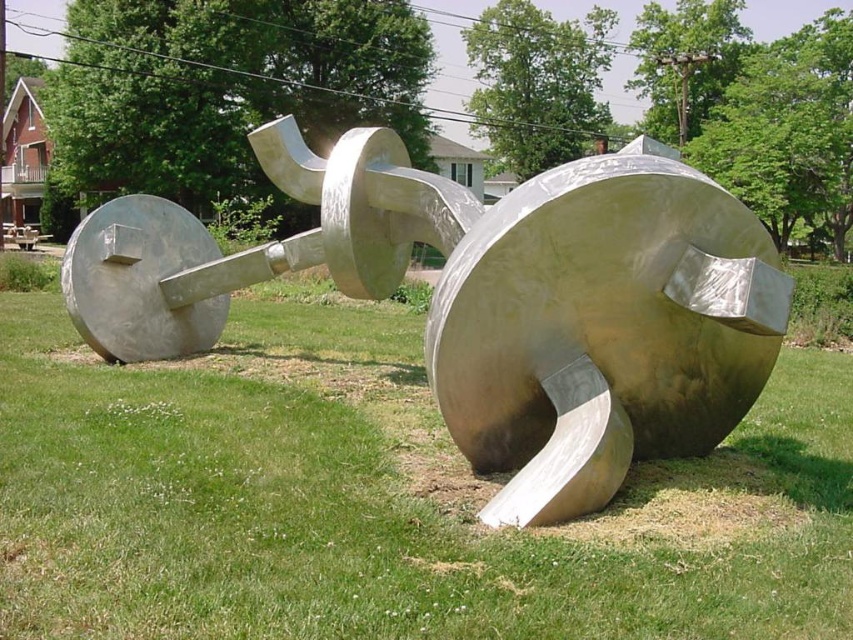
You are standing in front of the sculpture and want to step onto the green grass at center. In which direction should you move relative to the polished silver sculpture at center?

You should move to the left of the polished silver sculpture at center because the green grass at center is located to the left of it.

Based on the photo, you are a gardener who needs to water the green grass at center and the polished silver sculpture at center. You have a hose that can reach 10 feet. Can you water both areas without moving the hose?

The green grass at center and polished silver sculpture at center are 10.87 feet apart from each other. Since the hose can only reach 10 feet, you cannot water both areas without moving the hose because the distance exceeds the hose length.

In the scene shown: You are planning to place a small garden ornament that is 20 cm wide in the area shown. Based on the image, can the green grass at center accommodate the ornament without overlapping the polished silver sculpture at center?

The green grass at center has a larger width than the polished silver sculpture at center. Since the grass area is wider, the 20 cm wide garden ornament can be placed there without overlapping the sculpture.